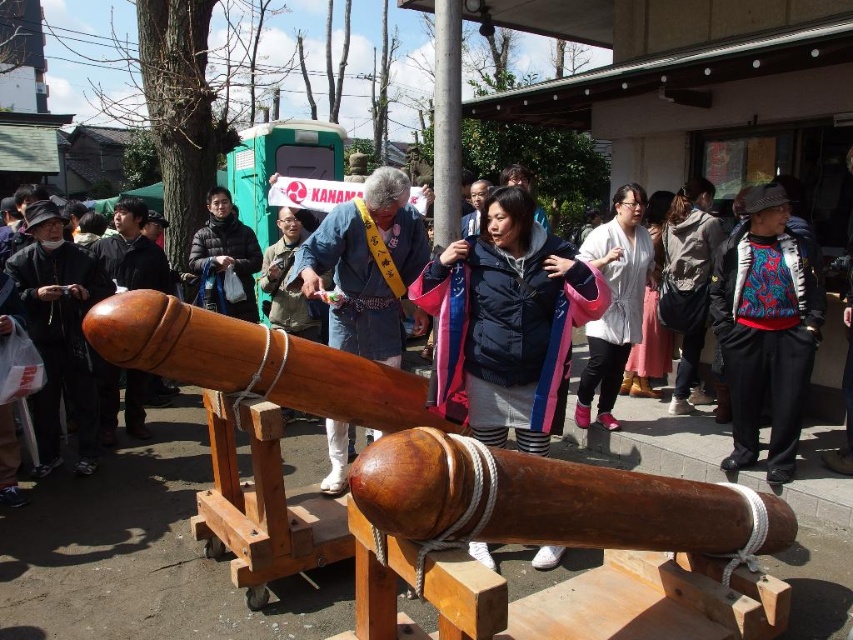
Is matte blue jacket at center behind blue and red patterned sweater at center?

No, it is in front of blue and red patterned sweater at center.

Can you confirm if matte blue jacket at center is positioned to the right of blue and red patterned sweater at center?

Incorrect, matte blue jacket at center is not on the right side of blue and red patterned sweater at center.

Find the location of `matte blue jacket at center`. matte blue jacket at center is located at coordinates (508, 321).

Does shiny brown wood cannon at center appear under matte black jacket at left?

Yes.

Identify the location of shiny brown wood cannon at center. (477, 492).

Where is `shiny brown wood cannon at center`? shiny brown wood cannon at center is located at coordinates (477, 492).

Which is above, matte blue jacket at center or matte black jacket at center?

matte black jacket at center is higher up.

Which of these two, matte blue jacket at center or matte black jacket at center, stands shorter?

matte black jacket at center is shorter.

Where is `matte blue jacket at center`? matte blue jacket at center is located at coordinates (508, 321).

You are a GUI agent. You are given a task and a screenshot of the screen. Output one action in this format:
    pyautogui.click(x=<x>, y=<y>)
    Task: Click on the matte blue jacket at center
    
    Given the screenshot: What is the action you would take?
    pyautogui.click(x=508, y=321)